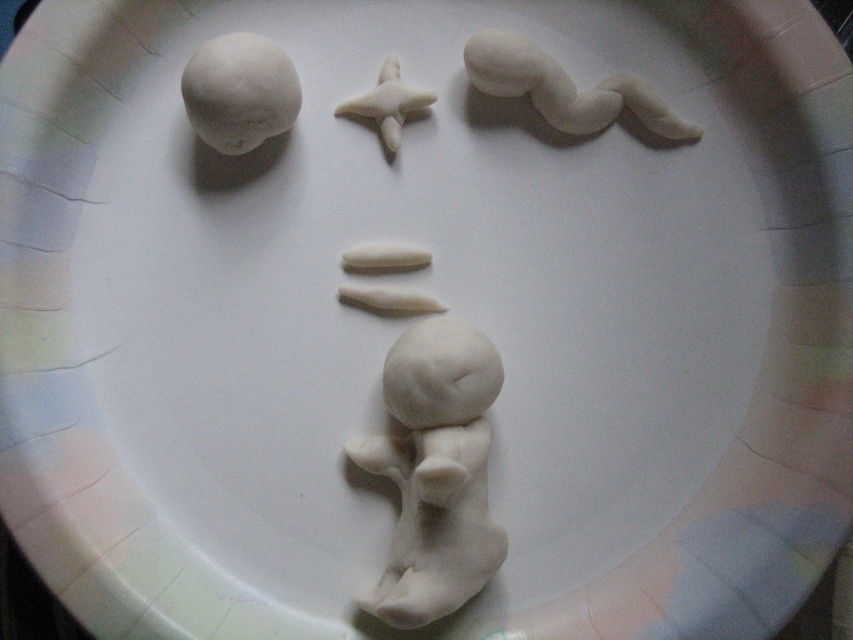
You are an artist arranging clay figures on a colorful plate. You have the white clay figure at center and the white matte clay head at upper left. Which one is positioned higher up on the plate?

The white matte clay head at upper left is positioned higher up on the plate since the white clay figure at center is below it.

You are an artist planning to place a new small clay sculpture on the circular plate. The existing figures include the white clay figure at center and the white matte clay head at upper left. Based on their sizes, where should you place the new sculpture to ensure it doesn

The white clay figure at center is larger than the white matte clay head at upper left. To maintain visual balance, place the new sculpture near the smaller white matte clay head at upper left to counterbalance the larger figure at the center.